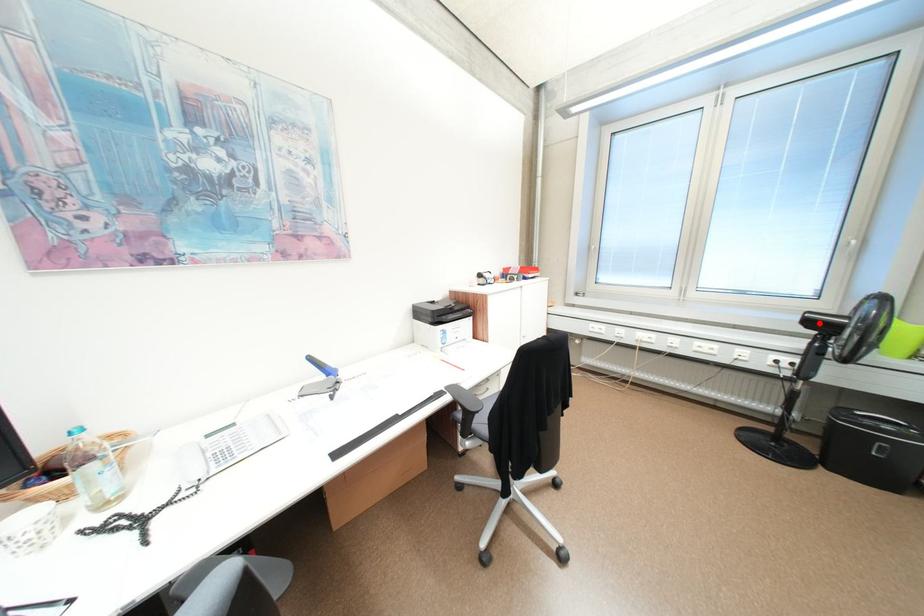
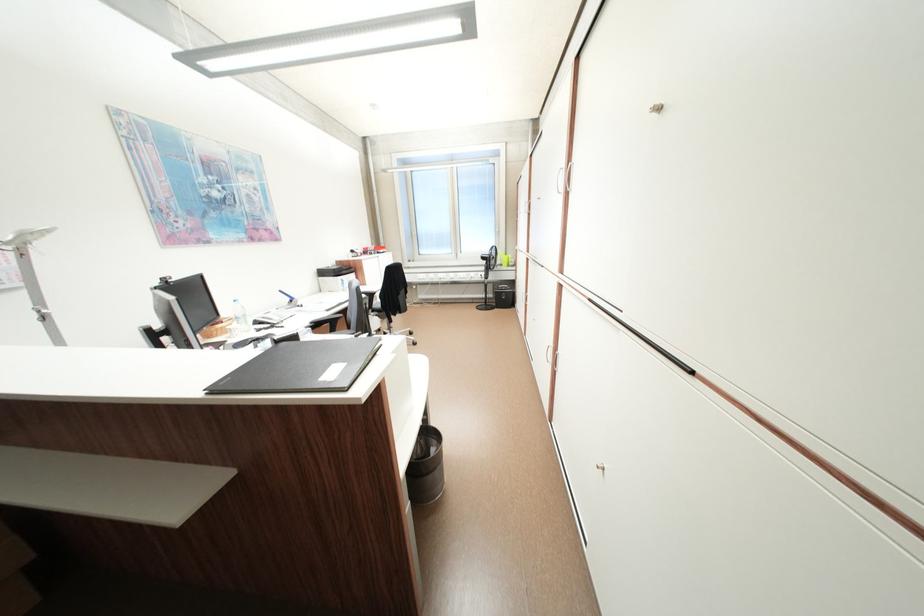
In the second image, find the point that corresponds to the highlighted location in the first image.

(492, 259)